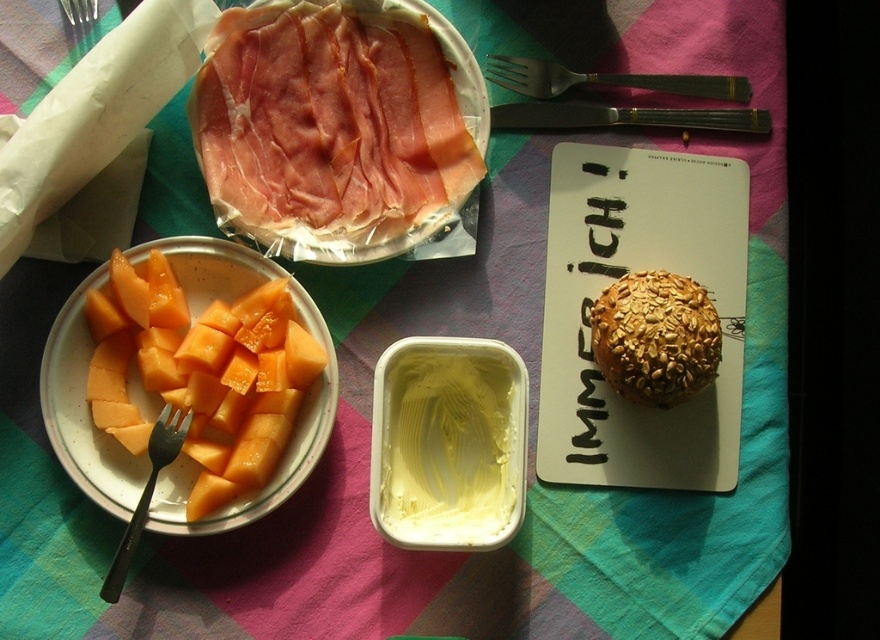
Does pinkish-red cured meat at upper center have a smaller size compared to silver metallic fork at upper center?

Actually, pinkish-red cured meat at upper center might be larger than silver metallic fork at upper center.

Image resolution: width=880 pixels, height=640 pixels. In order to click on pinkish-red cured meat at upper center in this screenshot , I will do `click(339, 125)`.

At what (x,y) coordinates should I click in order to perform the action: click on orange fleshed melon at left. Please return your answer as a coordinate pair (x, y). The image size is (880, 640). Looking at the image, I should click on (202, 372).

Can you confirm if orange fleshed melon at left is smaller than oatmeal-coated bagel at center-right?

Incorrect, orange fleshed melon at left is not smaller in size than oatmeal-coated bagel at center-right.

This screenshot has height=640, width=880. I want to click on orange fleshed melon at left, so click(x=202, y=372).

Is orange fleshed melon at left behind metallic silver fork at upper left?

No, it is not.

Describe the element at coordinates (202, 372) in the screenshot. The image size is (880, 640). I see `orange fleshed melon at left` at that location.

Which is behind, point (298, 376) or point (76, 4)?

Point (76, 4)

This screenshot has height=640, width=880. What are the coordinates of `orange fleshed melon at left` in the screenshot? It's located at (202, 372).